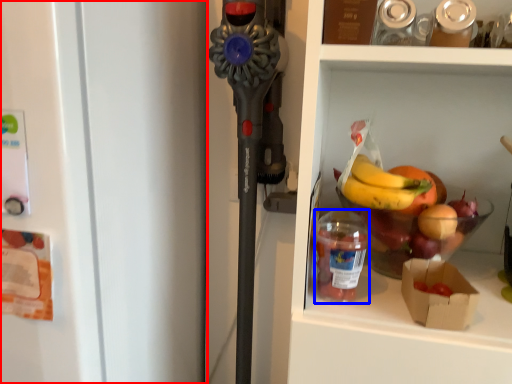
Question: Among these objects, which one is farthest to the camera, refrigerator (highlighted by a red box) or bottle (highlighted by a blue box)?

Choices:
 (A) refrigerator
 (B) bottle

Answer: (B)